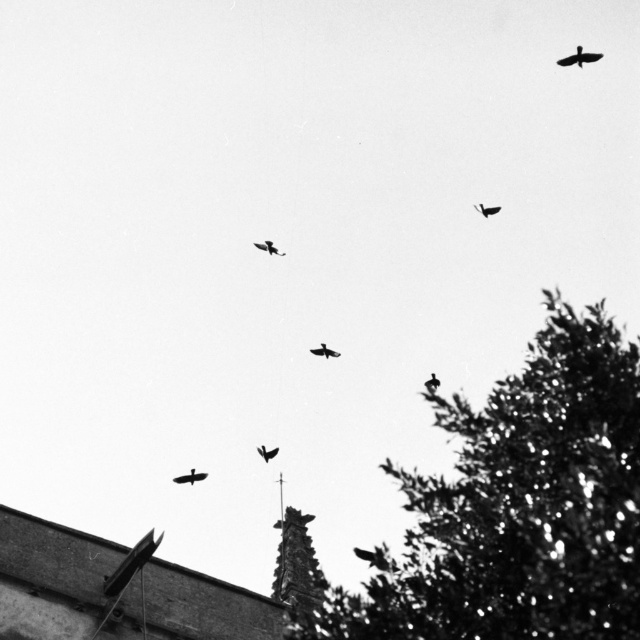
You are a photographer analyzing the image. You notice two birds at the center of the frame, a silhouette glossy bird at center and a black matte bird at center. Which of these two birds appears smaller in height?

The silhouette glossy bird at center has a lesser height compared to the black matte bird at center, so it appears smaller in height.